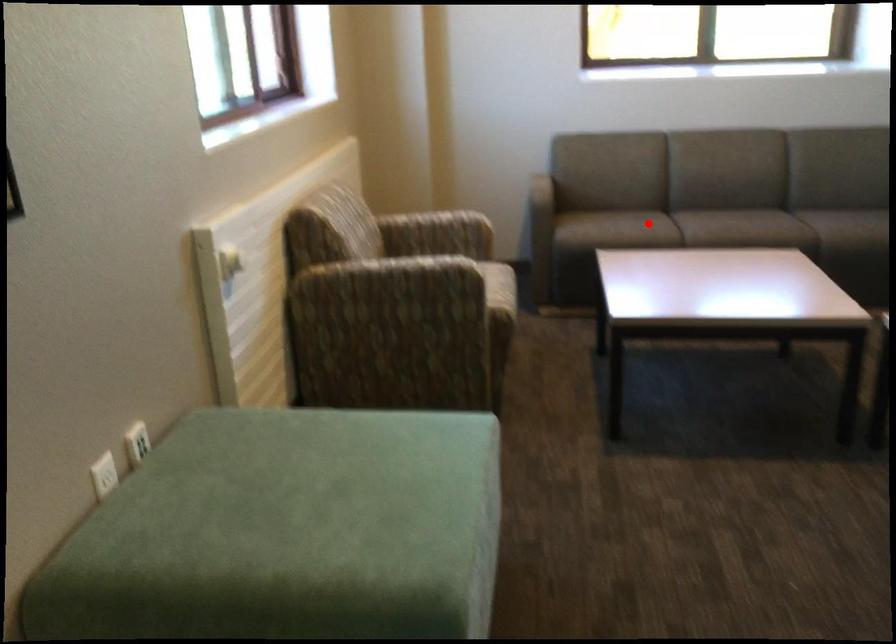
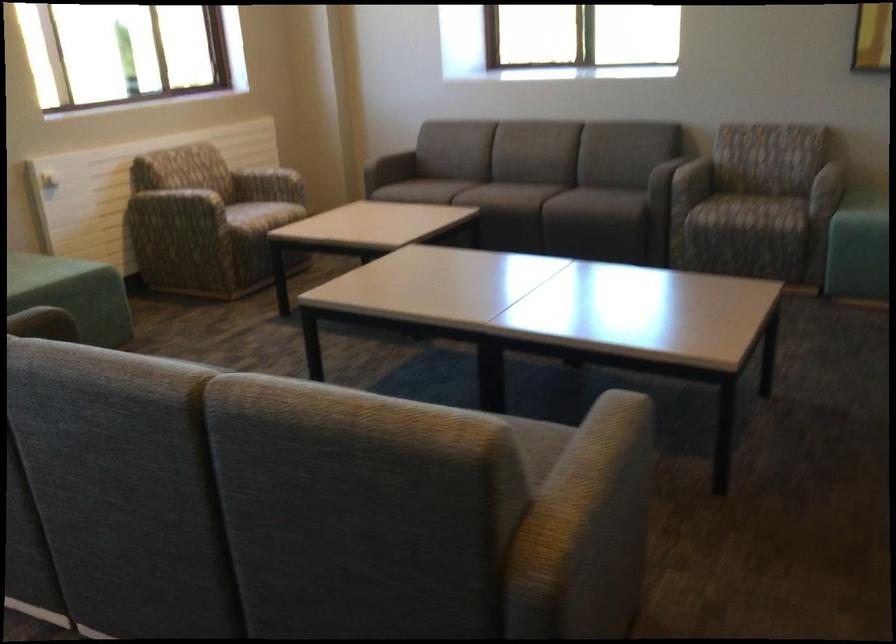
The point at the highlighted location is marked in the first image. Where is the corresponding point in the second image?

(455, 187)